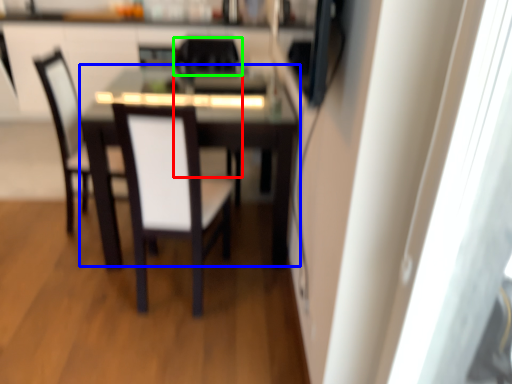
Question: Based on their relative distances, which object is nearer to chair (highlighted by a red box)? Choose from table (highlighted by a blue box) and chair (highlighted by a green box).

Choices:
 (A) table
 (B) chair

Answer: (B)